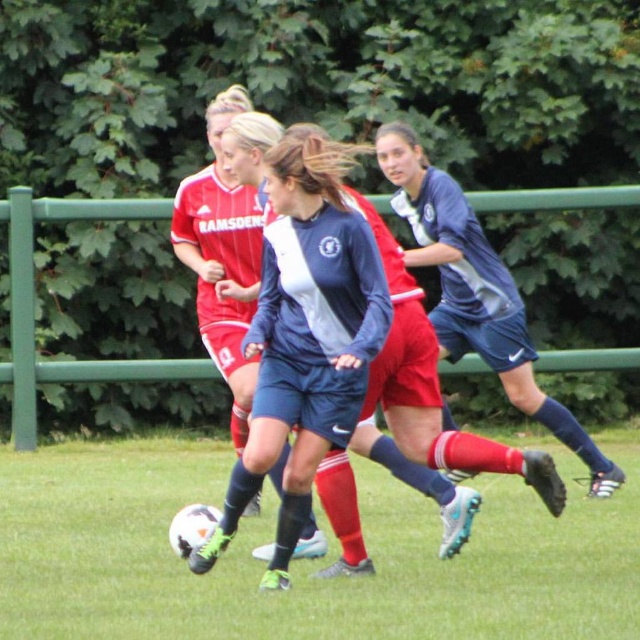
From the picture: Is white textured soccer ball at center wider than blue fabric soccer jersey at center?

Indeed, white textured soccer ball at center has a greater width compared to blue fabric soccer jersey at center.

How far apart are white textured soccer ball at center and blue fabric soccer jersey at center?

They are 4.60 feet apart.

Between point (93, 492) and point (285, 520), which one is positioned in front?

Point (285, 520)

Identify the location of white textured soccer ball at center. This screenshot has height=640, width=640. (305, 561).

Who is more forward, (358, 230) or (456, 285)?

Point (358, 230) is in front.

Is blue fabric soccer jersey at center wider than blue fabric jersey at center?

No.

Image resolution: width=640 pixels, height=640 pixels. Identify the location of blue fabric soccer jersey at center. (305, 337).

Can you confirm if white textured soccer ball at center is shorter than blue fabric jersey at center?

Yes.

Does white textured soccer ball at center have a smaller size compared to blue fabric jersey at center?

Yes.

This screenshot has height=640, width=640. In order to click on white textured soccer ball at center in this screenshot , I will do `click(305, 561)`.

Where is `white textured soccer ball at center`? white textured soccer ball at center is located at coordinates (305, 561).